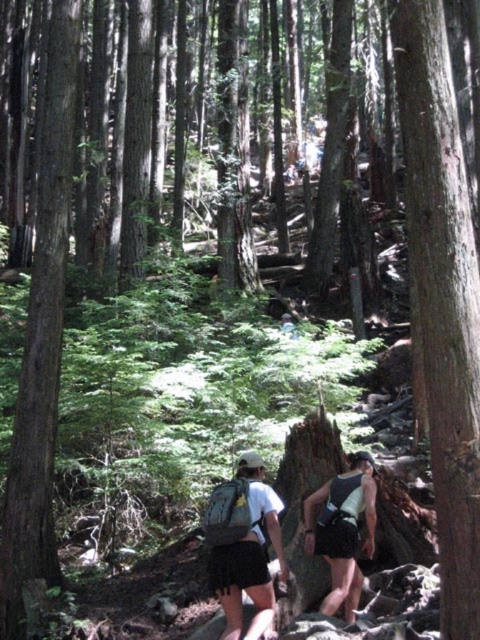
You are a hiker trying to decide which backpack to take for a short day hike. You notice the matte green backpack at center and the black mesh backpack at center. Based on their sizes, which one might be more suitable for carrying just a water bottle and snacks?

The matte green backpack at center occupies less space than the black mesh backpack at center, so it might be more suitable for carrying just a water bottle and snacks since it is smaller and more compact.

You are a photographer standing at the edge of the forest path. You want to take a photo that includes both the point at coordinates (249, 490) and the point at (311, 522). Which point will appear closer to the camera in your photo?

A: Point (249, 490) will appear closer to the camera in the photo because it is physically closer to the camera than point (311, 522).